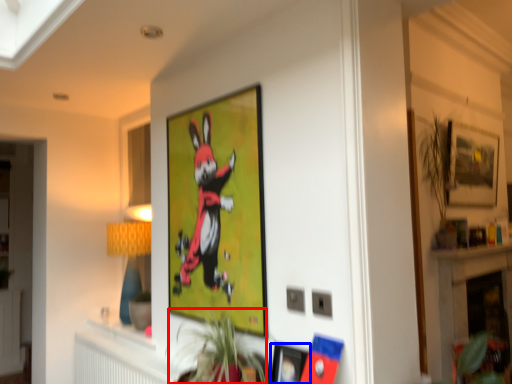
Question: Which object is closer to the camera taking this photo, plant (highlighted by a red box) or picture frame (highlighted by a blue box)?

Choices:
 (A) plant
 (B) picture frame

Answer: (A)